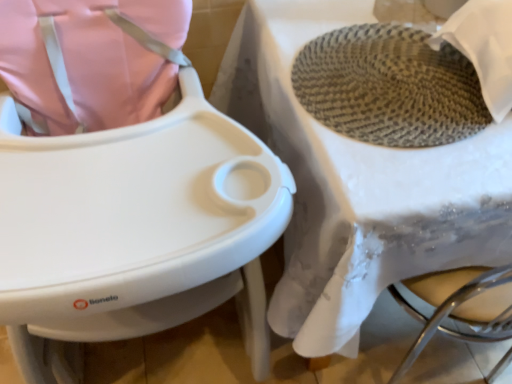
Question: From the image's perspective, is white textured table at center above rattan textured basket at upper right?

Choices:
 (A) no
 (B) yes

Answer: (B)

Question: Can you confirm if white textured table at center is shorter than rattan textured basket at upper right?

Choices:
 (A) no
 (B) yes

Answer: (B)

Question: From a real-world perspective, is white textured table at center positioned over rattan textured basket at upper right based on gravity?

Choices:
 (A) yes
 (B) no

Answer: (B)

Question: Could you tell me if white textured table at center is turned towards rattan textured basket at upper right?

Choices:
 (A) yes
 (B) no

Answer: (B)

Question: Is white textured table at center wider than rattan textured basket at upper right?

Choices:
 (A) yes
 (B) no

Answer: (A)

Question: From a real-world perspective, is white textured table at center beneath rattan textured basket at upper right?

Choices:
 (A) no
 (B) yes

Answer: (B)

Question: From the image's perspective, is rattan textured basket at upper right below white textured table at center?

Choices:
 (A) no
 (B) yes

Answer: (B)

Question: From the image's perspective, is rattan textured basket at upper right on top of white textured table at center?

Choices:
 (A) no
 (B) yes

Answer: (A)

Question: Is rattan textured basket at upper right facing away from white textured table at center?

Choices:
 (A) yes
 (B) no

Answer: (B)

Question: Does rattan textured basket at upper right have a larger size compared to white textured table at center?

Choices:
 (A) yes
 (B) no

Answer: (A)

Question: Can we say rattan textured basket at upper right lies outside white textured table at center?

Choices:
 (A) no
 (B) yes

Answer: (B)

Question: Can you confirm if rattan textured basket at upper right is smaller than white textured table at center?

Choices:
 (A) yes
 (B) no

Answer: (B)

Question: Considering the positions of white textured table at center and rattan textured basket at upper right in the image, is white textured table at center bigger or smaller than rattan textured basket at upper right?

Choices:
 (A) small
 (B) big

Answer: (A)